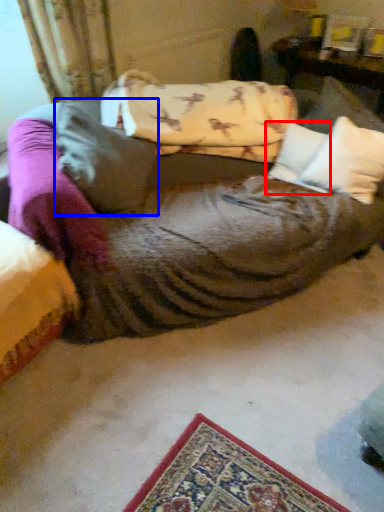
Question: Which point is further to the camera, pillow (highlighted by a red box) or pillow (highlighted by a blue box)?

Choices:
 (A) pillow
 (B) pillow

Answer: (A)